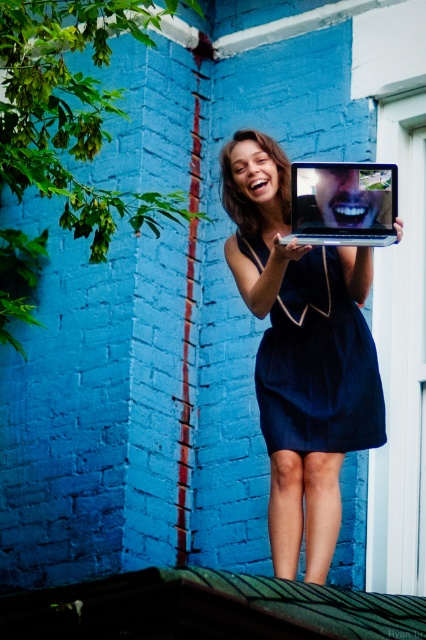
Measure the distance from shiny silver laptop at center to metallic silver laptop at center.

The distance of shiny silver laptop at center from metallic silver laptop at center is 6.93 feet.

Is point (284, 362) closer to camera compared to point (380, 173)?

That is False.

What are the coordinates of `shiny silver laptop at center` in the screenshot? It's located at (301, 353).

Is shiny silver laptop at center positioned before dark blue fabric dress at center?

Yes, shiny silver laptop at center is closer to the viewer.

The image size is (426, 640). What do you see at coordinates (301, 353) in the screenshot?
I see `shiny silver laptop at center` at bounding box center [301, 353].

The image size is (426, 640). Find the location of `shiny silver laptop at center`. shiny silver laptop at center is located at coordinates (301, 353).

Does dark blue fabric dress at center have a smaller size compared to metallic silver laptop at center?

No, dark blue fabric dress at center is not smaller than metallic silver laptop at center.

Does dark blue fabric dress at center appear under metallic silver laptop at center?

Correct, dark blue fabric dress at center is located below metallic silver laptop at center.

Is point (336, 449) positioned in front of point (305, 163)?

No, (336, 449) is behind (305, 163).

The image size is (426, 640). What are the coordinates of `dark blue fabric dress at center` in the screenshot? It's located at (317, 364).